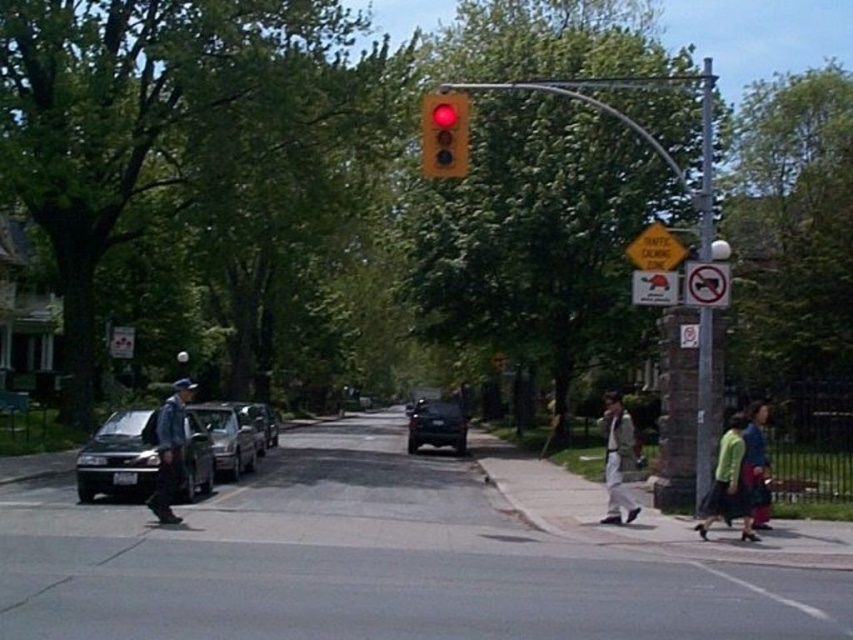
You are a delivery driver trying to navigate through the intersection shown in the image. The traffic light you need to obey is the matte red traffic light at upper center. According to the coordinates provided, where exactly is this traffic light located in the image?

The matte red traffic light at upper center is located at coordinates point (444,134).